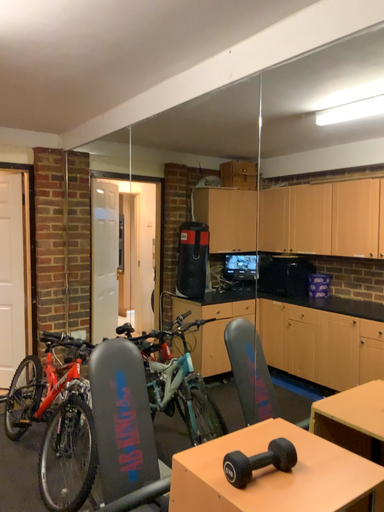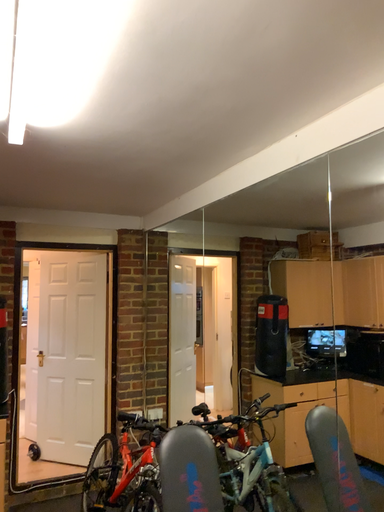
Question: Which way did the camera rotate in the video?

Choices:
 (A) rotated left
 (B) rotated right

Answer: (A)